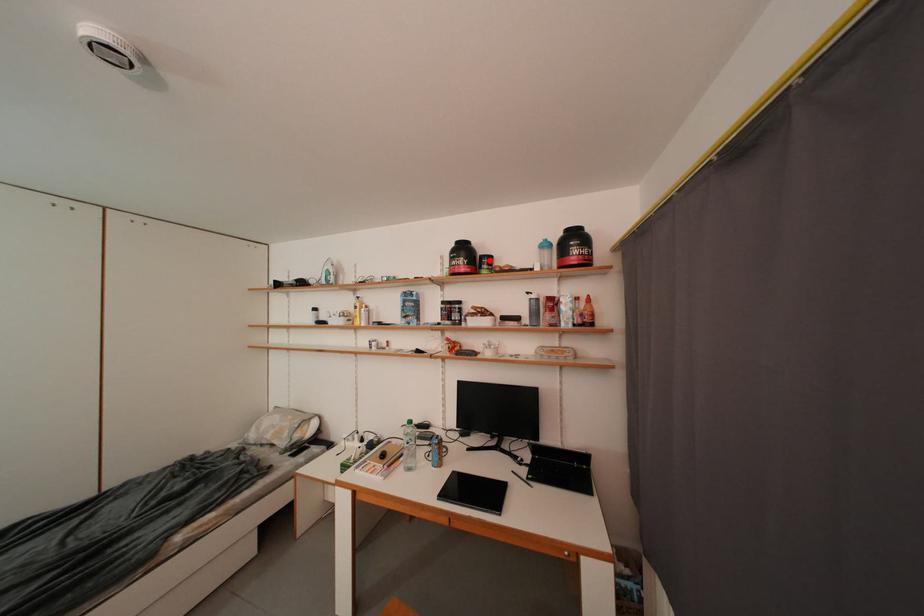
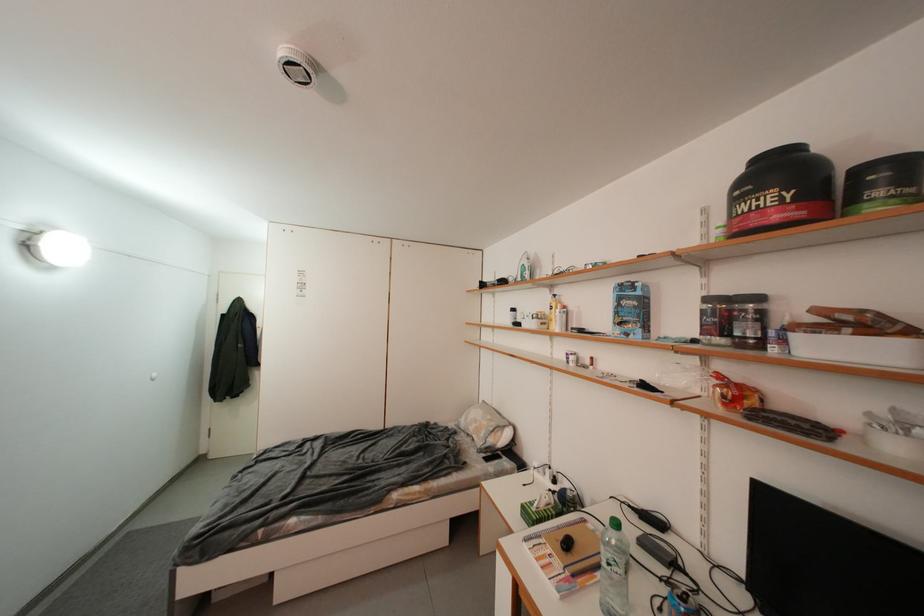
Find the pixel in the second image that matches the highlighted location in the first image.

(869, 174)